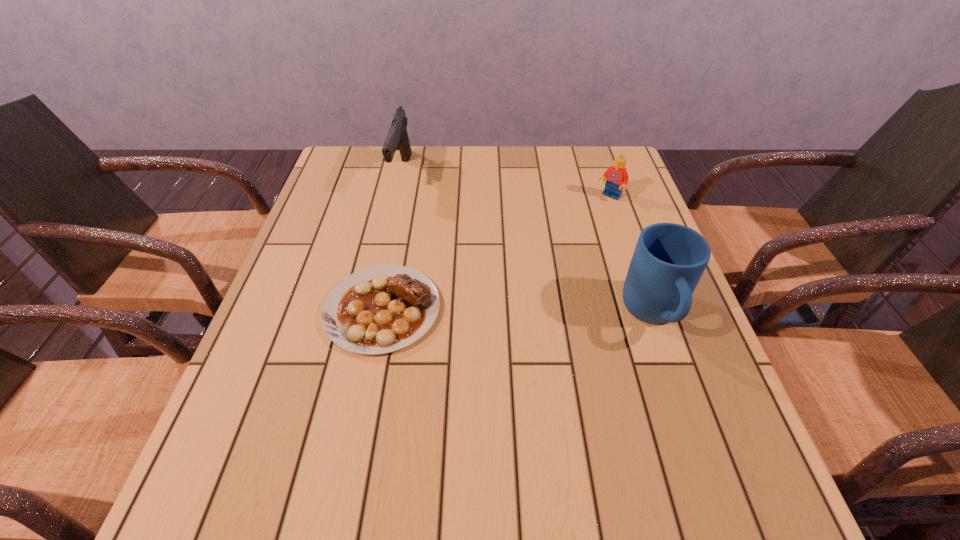
This screenshot has height=540, width=960. I want to click on steak, so click(381, 309).

The height and width of the screenshot is (540, 960). In order to click on mug in this screenshot , I will do `click(669, 259)`.

Locate an element on the screen. The height and width of the screenshot is (540, 960). Lego is located at coordinates (616, 176).

Where is `gun`? gun is located at coordinates (397, 138).

This screenshot has height=540, width=960. I want to click on vacant point located 0.110m on the left of the steak, so click(275, 309).

Where is `vacant position located on the side of the mug with the handle`? This screenshot has height=540, width=960. vacant position located on the side of the mug with the handle is located at coordinates (681, 390).

Locate an element on the screen. Image resolution: width=960 pixels, height=540 pixels. vacant space located 0.320m on the face of the second shortest object is located at coordinates (541, 265).

Locate an element on the screen. vacant space situated on the face of the second shortest object is located at coordinates (530, 277).

You are a GUI agent. You are given a task and a screenshot of the screen. Output one action in this format:
    pyautogui.click(x=<x>, y=<y>)
    Task: Click on the blank space located on the face of the second shortest object
    The width and height of the screenshot is (960, 540).
    Given the screenshot: What is the action you would take?
    552,254

The width and height of the screenshot is (960, 540). What are the coordinates of `vacant region located 0.110m at the muzzle of the gun` in the screenshot? It's located at (420, 215).